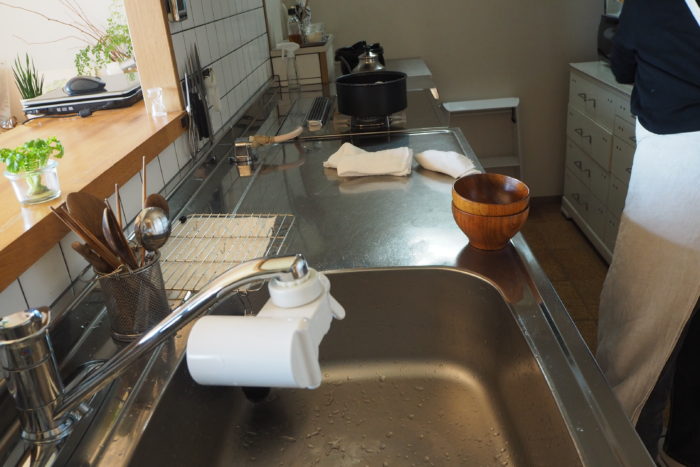
Where is `tile wall`? tile wall is located at coordinates click(225, 38), click(167, 155).